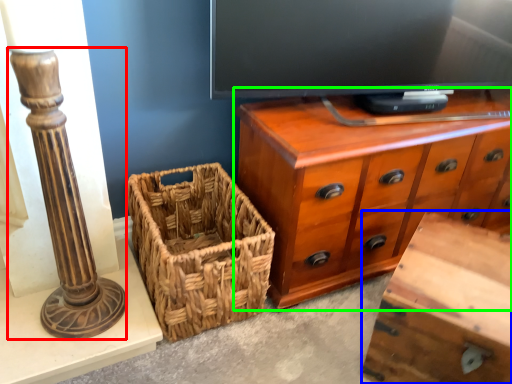
Question: Which object is the farthest from pillar (highlighted by a red box)? Choose among these: vanity (highlighted by a blue box) or chest of drawers (highlighted by a green box).

Choices:
 (A) vanity
 (B) chest of drawers

Answer: (A)